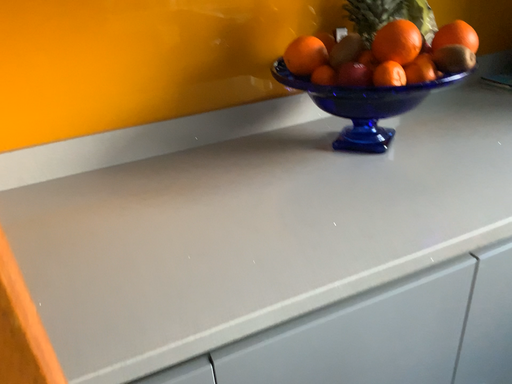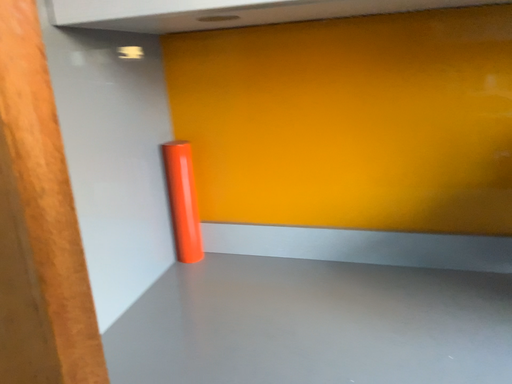
Question: Which way did the camera rotate in the video?

Choices:
 (A) rotated right
 (B) rotated left

Answer: (B)